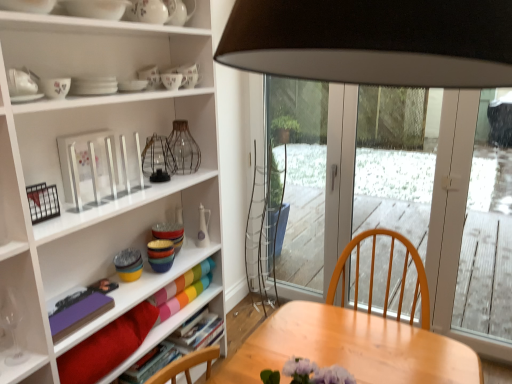
Question: Looking at their shapes, would you say multicolored glass bowls at center, which is the 11th tableware from top to bottom, is wider or thinner than matte red book at lower left, the 3th book from the back?

Choices:
 (A) wide
 (B) thin

Answer: (B)

Question: In the image, is multicolored glass bowls at center, which is the 11th tableware from top to bottom, positioned in front of or behind matte red book at lower left, the 3th book from the back?

Choices:
 (A) front
 (B) behind

Answer: (B)

Question: Based on their relative distances, which object is farther from the transparent glass wine glass at lower left?

Choices:
 (A) matte red book at lower left, the 3th book from the back
 (B) metallic wire basket at upper center, the 9th tableware positioned from the top
 (C) purple matte book at lower left, the 4th book when ordered from back to front
 (D) white glossy plates at upper center, which appears as the 6th tableware when ordered from the bottom
 (E) transparent glass vase at center

Answer: (E)

Question: Which object is positioned farthest from the white glossy bowl at upper center, the 11th tableware positioned from the bottom?

Choices:
 (A) multicolored ceramic bowls at center, the 12th tableware positioned from the top
 (B) purple matte book at lower left, acting as the first book starting from the front
 (C) velvet red cushion at lower left
 (D) transparent glass vase at center
 (E) white glossy vase at upper center, which appears as the first tableware when viewed from the top

Answer: (C)